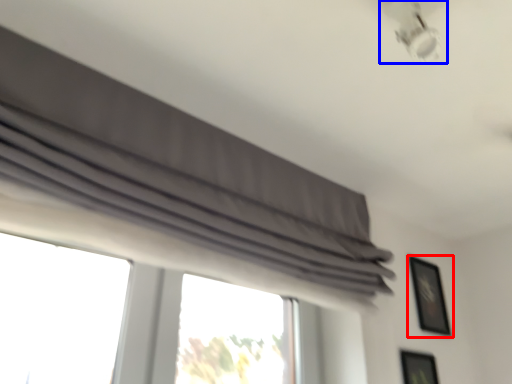
Question: Which object is further to the camera taking this photo, picture frame (highlighted by a red box) or lamp (highlighted by a blue box)?

Choices:
 (A) picture frame
 (B) lamp

Answer: (A)